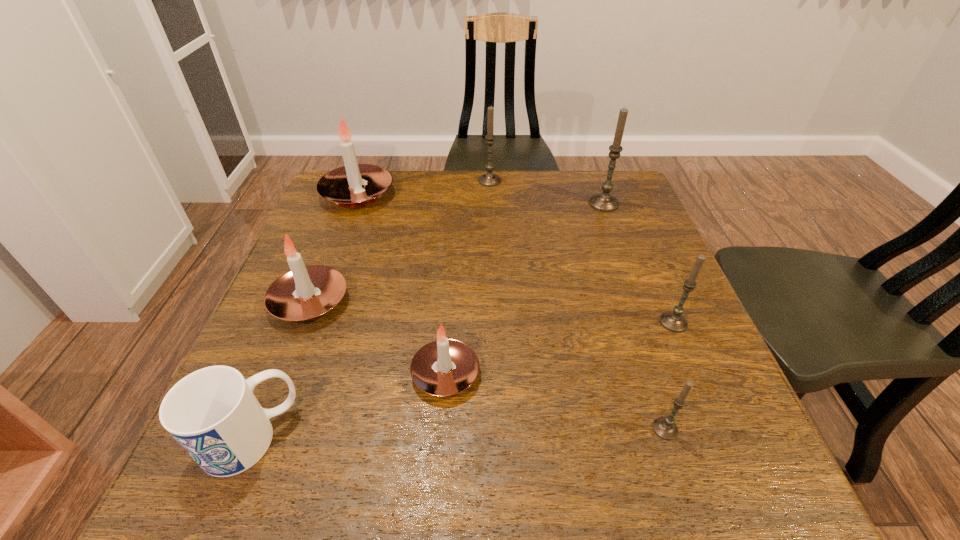
You are a GUI agent. You are given a task and a screenshot of the screen. Output one action in this format:
    pyautogui.click(x=<x>, y=<y>)
    Task: Click on the free spot that satisfies the following two spatial constraints: 1. on the front side of the biggest white candle; 2. on the right side of the second farthest gray candle
    
    Given the screenshot: What is the action you would take?
    pyautogui.click(x=354, y=204)